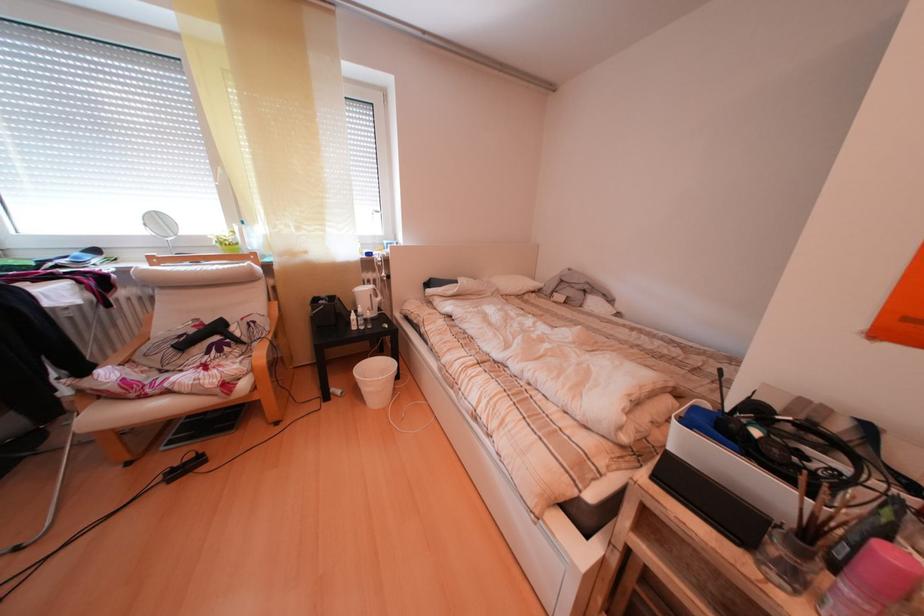
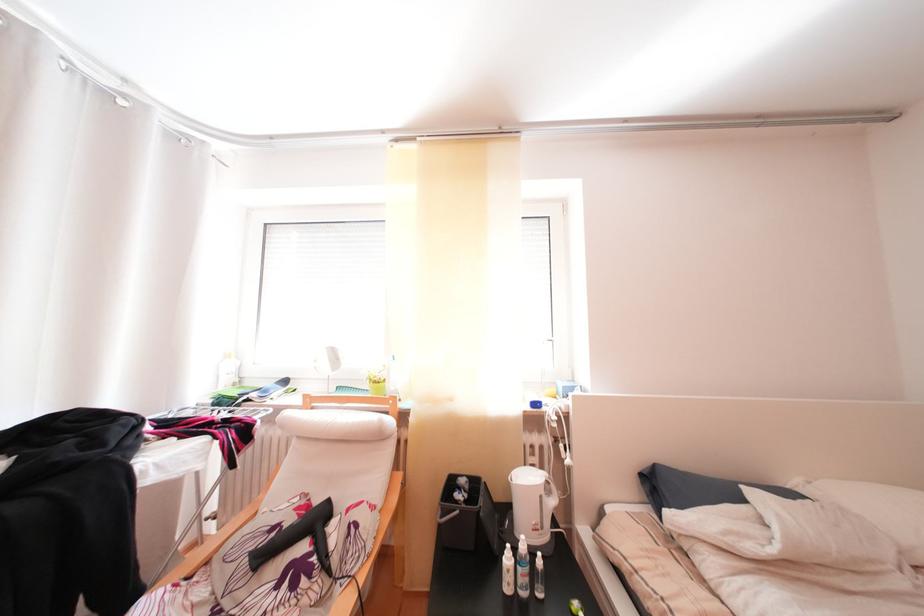
Where in the second image is the point corresponding to pixel 360 328 from the first image?

(509, 565)